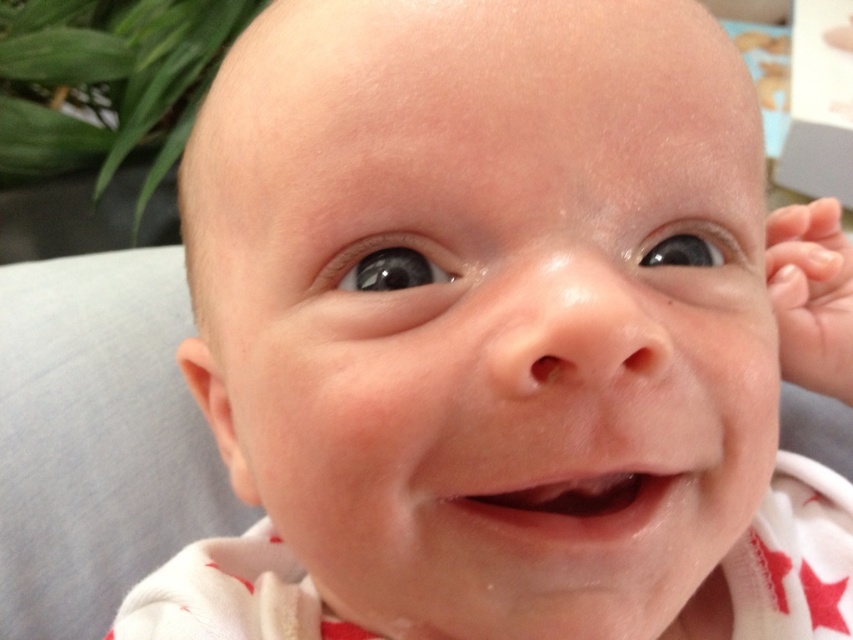
Is smooth skin baby at center to the right of pale skin hand at right from the viewer's perspective?

In fact, smooth skin baby at center is to the left of pale skin hand at right.

Is point (544, 36) farther from viewer compared to point (851, 320)?

No.

This screenshot has width=853, height=640. I want to click on smooth skin baby at center, so click(x=494, y=308).

Which of these two, smooth skin baby at center or smooth flesh mouth at center, stands shorter?

With less height is smooth flesh mouth at center.

Identify the location of smooth skin baby at center. The width and height of the screenshot is (853, 640). (494, 308).

Which is behind, point (793, 269) or point (561, 529)?

Point (793, 269)

What do you see at coordinates (811, 296) in the screenshot?
I see `pale skin hand at right` at bounding box center [811, 296].

Is point (799, 316) more distant than point (573, 492)?

Yes.

Find the location of a particular element. The height and width of the screenshot is (640, 853). pale skin hand at right is located at coordinates 811,296.